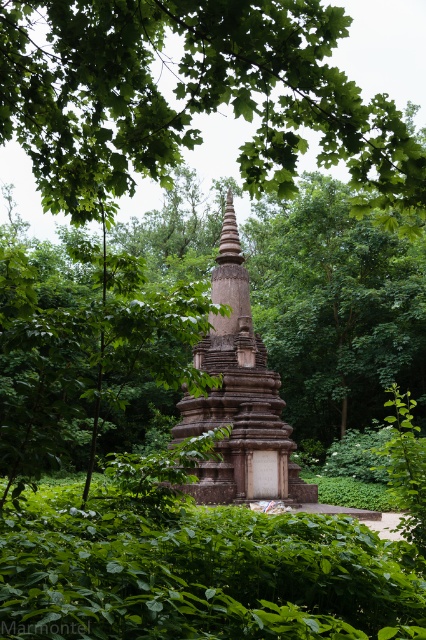
Which of these two, green leafy tree at center or brown stone tower at center, stands shorter?

brown stone tower at center

Which is below, green leafy tree at center or brown stone tower at center?

brown stone tower at center is below.

This screenshot has height=640, width=426. Describe the element at coordinates (190, 97) in the screenshot. I see `green leafy tree at center` at that location.

The image size is (426, 640). Find the location of `green leafy tree at center`. green leafy tree at center is located at coordinates (190, 97).